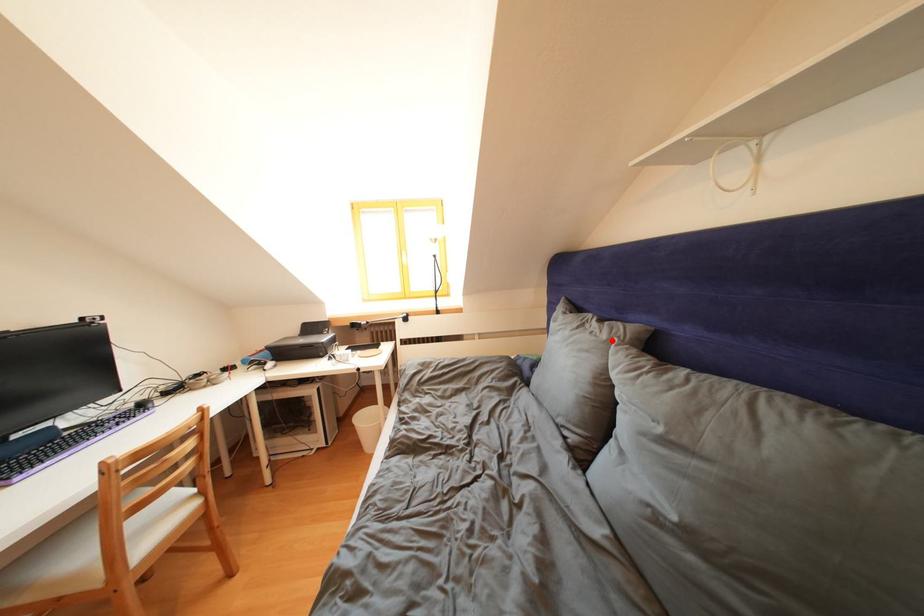
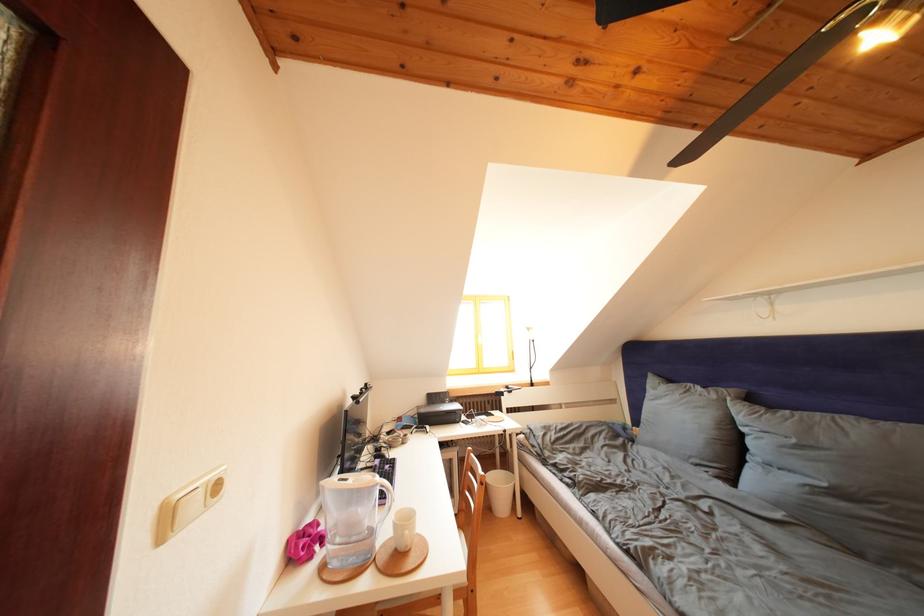
Question: I am providing you with two images of the same scene from different viewpoints. A red point is marked on the first image. At the location where the point appears in image 1, is it still visible in image 2?

Choices:
 (A) Yes
 (B) No

Answer: (A)